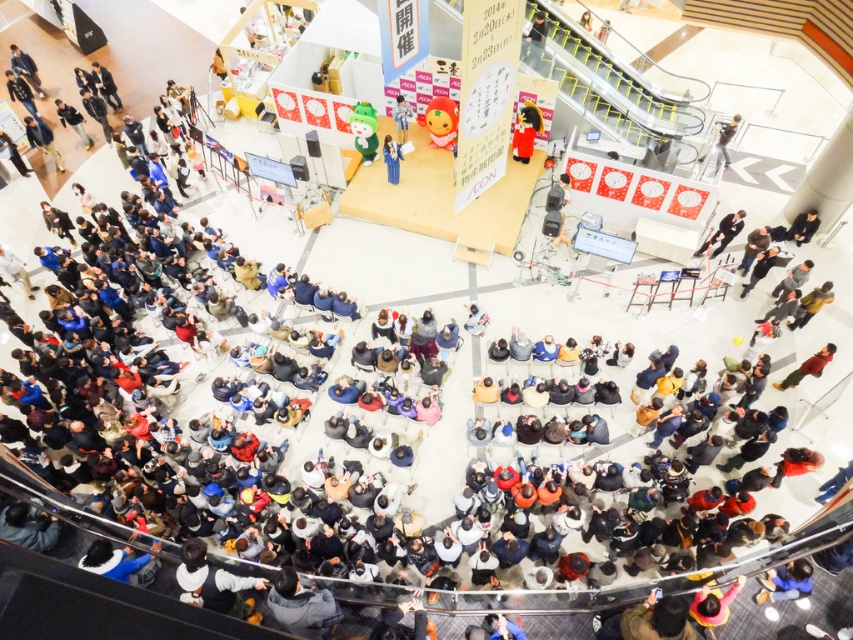
Question: Based on their relative distances, which object is farther from the matte red plush toy at center?

Choices:
 (A) dark blue jeans at lower right
 (B) light brown leather jacket at upper right
 (C) matte blue kimono at center
 (D) matte blue dress at center

Answer: (A)

Question: Is light brown leather jacket at lower right thinner than matte blue dress at center?

Choices:
 (A) no
 (B) yes

Answer: (A)

Question: Is matte red plush toy at center above dark blue jeans at lower right?

Choices:
 (A) no
 (B) yes

Answer: (B)

Question: Estimate the real-world distances between objects in this image. Which object is farther from the dark blue jeans at lower right?

Choices:
 (A) matte blue dress at center
 (B) matte red plush toy at center

Answer: (A)

Question: Does light brown leather jacket at lower right have a lesser width compared to dark blue jeans at lower right?

Choices:
 (A) yes
 (B) no

Answer: (A)

Question: Which point is farther to the camera?

Choices:
 (A) matte blue dress at center
 (B) matte red plush toy at center
 (C) light brown leather jacket at upper right
 (D) dark blue jeans at lower right

Answer: (C)